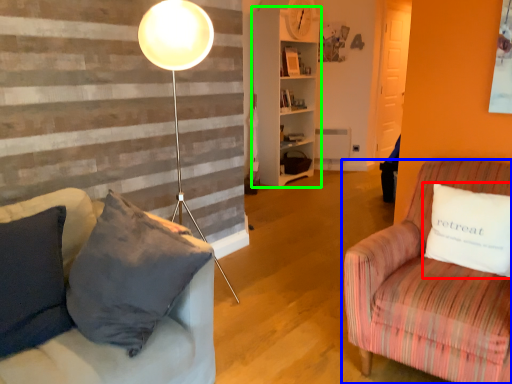
Question: Based on their relative distances, which object is farther from pillow (highlighted by a red box)? Choose from studio couch (highlighted by a blue box) and shelf (highlighted by a green box).

Choices:
 (A) studio couch
 (B) shelf

Answer: (B)